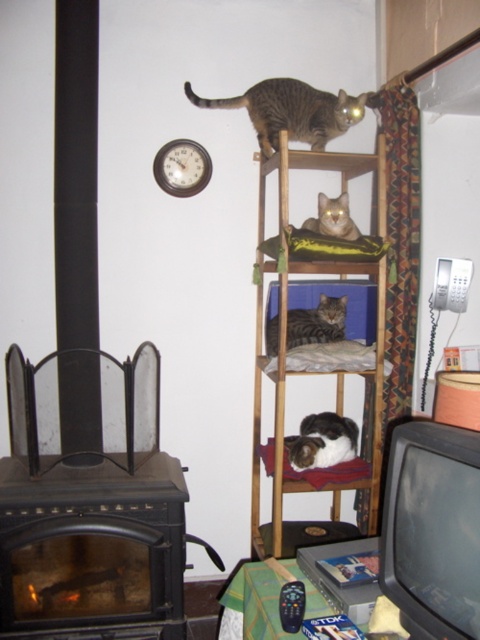
Find the location of a particular element. fluffy white cat at center is located at coordinates (322, 442).

Does fluffy white cat at center have a smaller size compared to tabby fur cat at center?

No.

Locate an element on the screen. Image resolution: width=480 pixels, height=640 pixels. fluffy white cat at center is located at coordinates (322, 442).

Where is `fluffy white cat at center`? fluffy white cat at center is located at coordinates (322, 442).

Does black matte fireplace at left appear over wooden clock at upper center?

Incorrect, black matte fireplace at left is not positioned above wooden clock at upper center.

Between point (39, 611) and point (166, 163), which one is positioned in front?

Point (39, 611)

Does point (56, 596) come behind point (167, 168)?

No, it is not.

Identify the location of black matte fireplace at left. The image size is (480, 640). (92, 547).

Is tabby cat at upper center bigger than tabby fur cat at center?

Indeed, tabby cat at upper center has a larger size compared to tabby fur cat at center.

I want to click on tabby cat at upper center, so click(x=290, y=112).